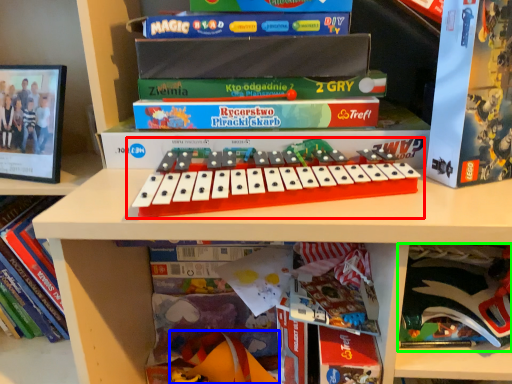
Question: Which is nearer to the musical keyboard (highlighted by a red box)? toy (highlighted by a blue box) or paperback book (highlighted by a green box).

Choices:
 (A) toy
 (B) paperback book

Answer: (B)